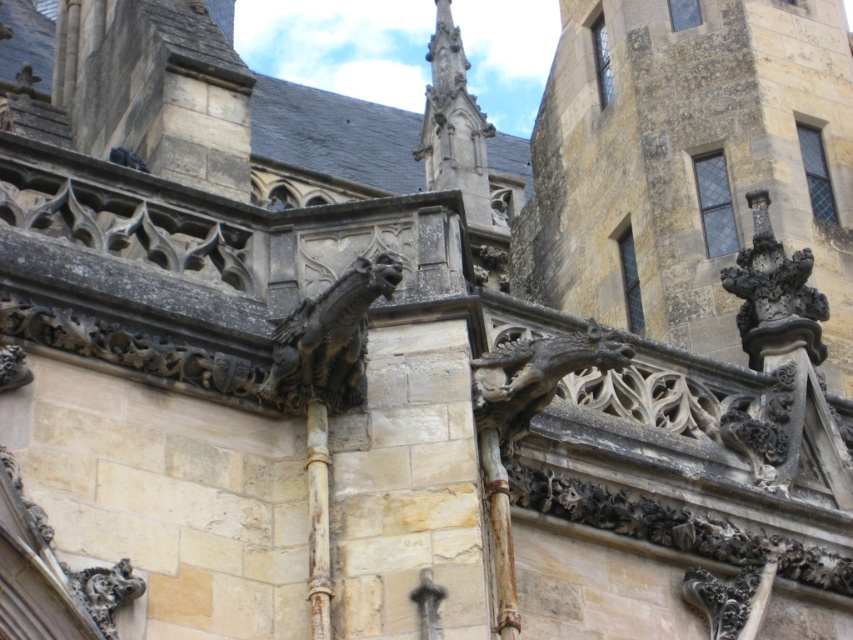
You are an architect examining the historic building. You notice a point marked at coordinates (328, 339). What object is located at this point?

The point at coordinates (328, 339) is occupied by the dark stone gargoyle at center.

Consider the image. You are an architect inspecting the facade of a historic building. You notice two gargoyles on the roofline. The dark stone gargoyle at center and the carved stone gargoyle at upper right. Which gargoyle is positioned to the left when viewed from the front of the building?

The dark stone gargoyle at center is positioned to the left of the carved stone gargoyle at upper right.